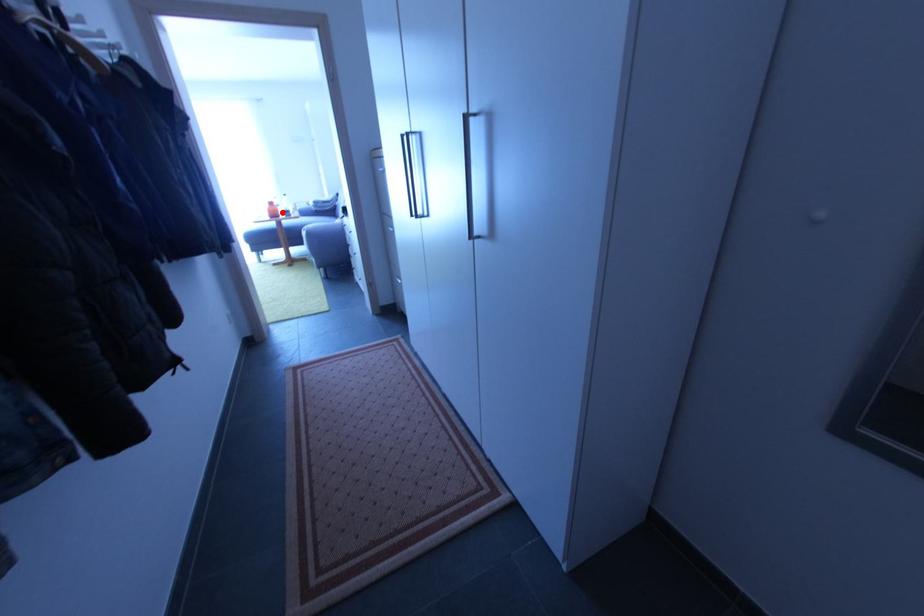
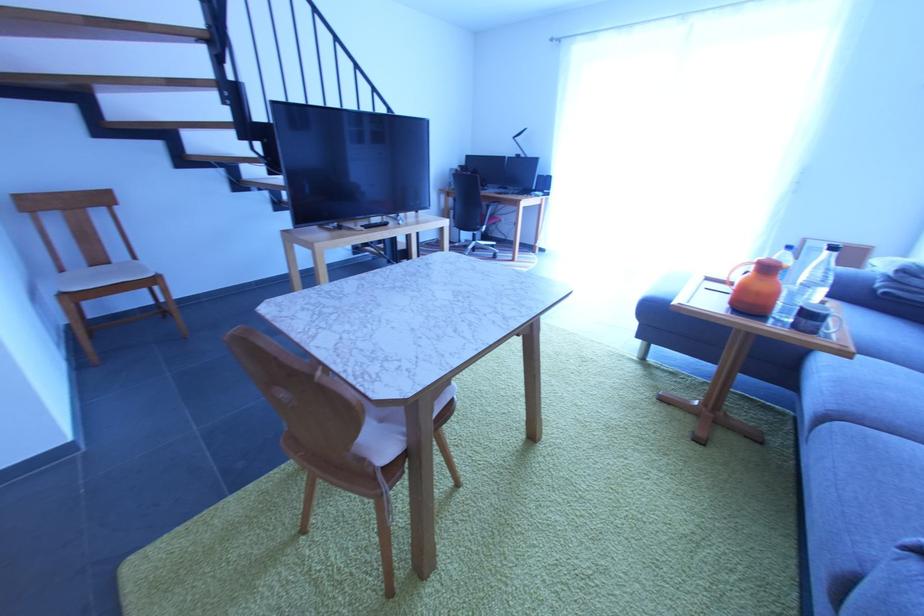
Question: I am providing you with two images of the same scene from different viewpoints. A red point is shown in image1. For the corresponding object point in image2, is it positioned nearer or farther from the camera?

Choices:
 (A) Nearer
 (B) Farther

Answer: (B)